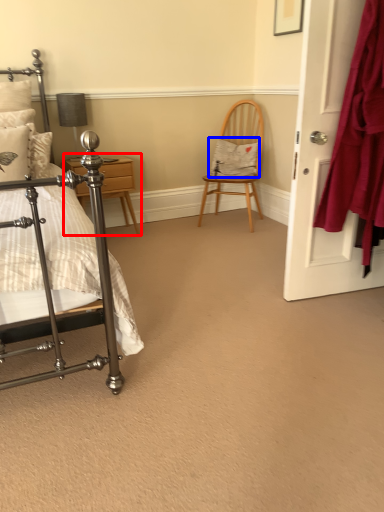
Question: Which of the following is the farthest to the observer, nightstand (highlighted by a red box) or pillow (highlighted by a blue box)?

Choices:
 (A) nightstand
 (B) pillow

Answer: (B)